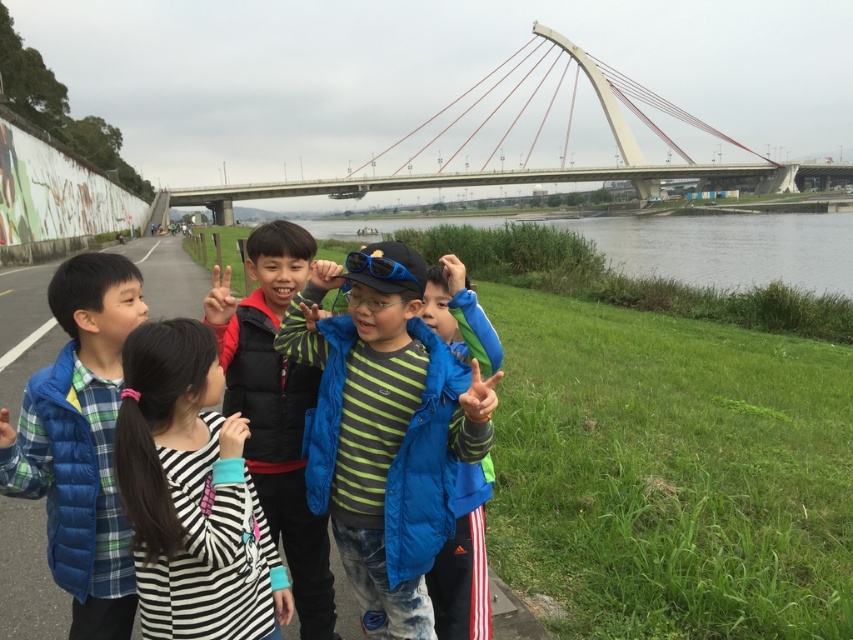
You are planning to take a photo of the white concrete bridge at upper center and the blue fleece jacket at center from a distance. Given that the minimum distance required to capture both objects clearly in one frame is 450 feet, will you be able to do so?

The white concrete bridge at upper center and blue fleece jacket at center are 455.53 feet apart from each other, which exceeds the minimum distance of 450 feet required to capture both clearly in one frame. Therefore, you will not be able to capture both objects clearly in a single frame from that distance.